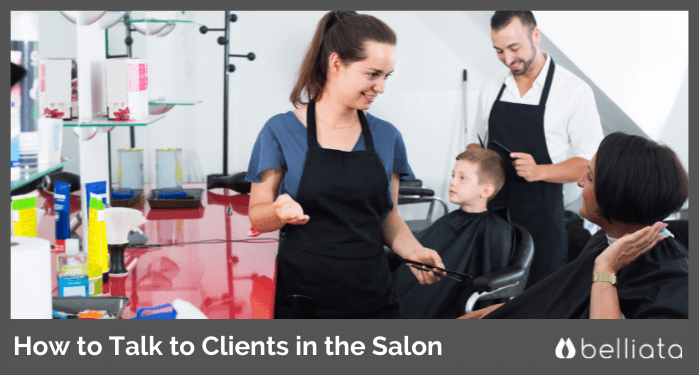
Identify the location of coat rack. This screenshot has height=375, width=699. (226, 86).